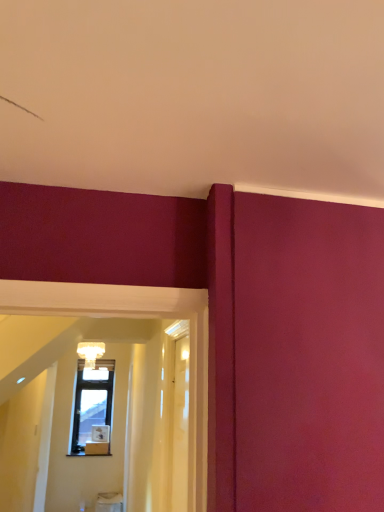
The image size is (384, 512). Find the location of `transparent wood door at center, acting as the first glass door starting from the left`. transparent wood door at center, acting as the first glass door starting from the left is located at coordinates pyautogui.click(x=180, y=426).

This screenshot has height=512, width=384. What do you see at coordinates (180, 426) in the screenshot?
I see `transparent wood door at center, acting as the first glass door starting from the left` at bounding box center [180, 426].

Find the location of a particular element. The image size is (384, 512). transparent wood door at center, marked as the second glass door in a right-to-left arrangement is located at coordinates [180, 426].

Considering the positions of objects transparent wood door at center, acting as the first glass door starting from the left, and matte glass chandelier at upper center in the image provided, who is in front, transparent wood door at center, acting as the first glass door starting from the left, or matte glass chandelier at upper center?

transparent wood door at center, acting as the first glass door starting from the left.

Is transparent wood door at center, marked as the second glass door in a right-to-left arrangement, looking in the opposite direction of matte glass chandelier at upper center?

transparent wood door at center, marked as the second glass door in a right-to-left arrangement, does not have its back to matte glass chandelier at upper center.

Consider the image. Between transparent wood door at center, acting as the first glass door starting from the left, and matte glass chandelier at upper center, which one has smaller width?

With smaller width is transparent wood door at center, acting as the first glass door starting from the left.

Looking at the image, does matte glass chandelier at upper center seem bigger or smaller compared to transparent wood door at center, marked as the second glass door in a right-to-left arrangement?

matte glass chandelier at upper center is bigger than transparent wood door at center, marked as the second glass door in a right-to-left arrangement.

Is matte glass chandelier at upper center behind transparent wood door at center, marked as the second glass door in a right-to-left arrangement?

Yes, the depth of matte glass chandelier at upper center is greater than that of transparent wood door at center, marked as the second glass door in a right-to-left arrangement.

Is matte glass chandelier at upper center oriented towards transparent wood door at center, marked as the second glass door in a right-to-left arrangement?

Yes, matte glass chandelier at upper center faces towards transparent wood door at center, marked as the second glass door in a right-to-left arrangement.

Based on the photo, from the image's perspective, which is above, matte glass chandelier at upper center or transparent wood door at center, marked as the second glass door in a right-to-left arrangement?

From the image's view, transparent wood door at center, marked as the second glass door in a right-to-left arrangement, is above.

Locate an element on the screen. Image resolution: width=384 pixels, height=512 pixels. glass door above the transparent wood door at center, acting as the first glass door starting from the left (from the image's perspective) is located at coordinates (176, 425).

Considering the relative positions of transparent wood door at center, marked as the second glass door in a right-to-left arrangement, and transparent glass door at center, marked as the 1th glass door in a right-to-left arrangement, in the image provided, is transparent wood door at center, marked as the second glass door in a right-to-left arrangement, in front of transparent glass door at center, marked as the 1th glass door in a right-to-left arrangement,?

No, the depth of transparent wood door at center, marked as the second glass door in a right-to-left arrangement, is greater than that of transparent glass door at center, marked as the 1th glass door in a right-to-left arrangement.

From a real-world perspective, which object stands above the other?

In real-world perspective, transparent glass door at center, marked as the second glass door in a left-to-right arrangement, is above.

From the image's perspective, is transparent wood door at center, acting as the first glass door starting from the left, on top of transparent glass door at center, marked as the 1th glass door in a right-to-left arrangement?

Actually, transparent wood door at center, acting as the first glass door starting from the left, appears below transparent glass door at center, marked as the 1th glass door in a right-to-left arrangement, in the image.

Is transparent glass door at center, marked as the 1th glass door in a right-to-left arrangement, wider than matte glass chandelier at upper center?

In fact, transparent glass door at center, marked as the 1th glass door in a right-to-left arrangement, might be narrower than matte glass chandelier at upper center.

Can you confirm if transparent glass door at center, marked as the 1th glass door in a right-to-left arrangement, is positioned to the right of matte glass chandelier at upper center?

Yes, transparent glass door at center, marked as the 1th glass door in a right-to-left arrangement, is to the right of matte glass chandelier at upper center.

Does transparent glass door at center, marked as the 1th glass door in a right-to-left arrangement, touch matte glass chandelier at upper center?

No.

Can you confirm if transparent glass door at center, marked as the second glass door in a left-to-right arrangement, is taller than matte glass chandelier at upper center?

Yes, transparent glass door at center, marked as the second glass door in a left-to-right arrangement, is taller than matte glass chandelier at upper center.

Consider the image. Considering the sizes of objects transparent glass door at center, marked as the 1th glass door in a right-to-left arrangement, and transparent wood door at center, acting as the first glass door starting from the left, in the image provided, who is wider, transparent glass door at center, marked as the 1th glass door in a right-to-left arrangement, or transparent wood door at center, acting as the first glass door starting from the left,?

transparent glass door at center, marked as the 1th glass door in a right-to-left arrangement, is wider.

Identify the location of glass door that is above the transparent wood door at center, acting as the first glass door starting from the left (from a real-world perspective). (176, 425).

Considering the relative positions of transparent glass door at center, marked as the second glass door in a left-to-right arrangement, and transparent wood door at center, acting as the first glass door starting from the left, in the image provided, is transparent glass door at center, marked as the second glass door in a left-to-right arrangement, in front of transparent wood door at center, acting as the first glass door starting from the left,?

Yes, transparent glass door at center, marked as the second glass door in a left-to-right arrangement, is closer to the camera.

Who is shorter, transparent glass door at center, marked as the 1th glass door in a right-to-left arrangement, or transparent wood door at center, marked as the second glass door in a right-to-left arrangement?

With less height is transparent wood door at center, marked as the second glass door in a right-to-left arrangement.

Based on the photo, is matte glass chandelier at upper center beside transparent glass door at center, marked as the 1th glass door in a right-to-left arrangement?

No, matte glass chandelier at upper center is not next to transparent glass door at center, marked as the 1th glass door in a right-to-left arrangement.

Considering the sizes of objects matte glass chandelier at upper center and transparent glass door at center, marked as the 1th glass door in a right-to-left arrangement, in the image provided, who is wider, matte glass chandelier at upper center or transparent glass door at center, marked as the 1th glass door in a right-to-left arrangement,?

Wider between the two is matte glass chandelier at upper center.

From a real-world perspective, is matte glass chandelier at upper center positioned above or below transparent glass door at center, marked as the 1th glass door in a right-to-left arrangement?

matte glass chandelier at upper center is above transparent glass door at center, marked as the 1th glass door in a right-to-left arrangement.

Identify the location of the 1st glass door in front of the matte glass chandelier at upper center, starting your count from the anchor. [x=180, y=426].

From the matte glass chandelier at upper center, count 1st glass door to the right and point to it. Please provide its 2D coordinates.

[(180, 426)]

Which object lies nearer to the anchor point transparent glass door at center, marked as the second glass door in a left-to-right arrangement, matte glass chandelier at upper center or transparent wood door at center, acting as the first glass door starting from the left?

Based on the image, transparent wood door at center, acting as the first glass door starting from the left, appears to be nearer to transparent glass door at center, marked as the second glass door in a left-to-right arrangement.

Which object lies nearer to the anchor point matte glass chandelier at upper center, transparent wood door at center, acting as the first glass door starting from the left, or transparent glass door at center, marked as the second glass door in a left-to-right arrangement?

transparent glass door at center, marked as the second glass door in a left-to-right arrangement, is closer to matte glass chandelier at upper center.

Based on their spatial positions, is matte glass chandelier at upper center or transparent glass door at center, marked as the 1th glass door in a right-to-left arrangement, closer to transparent wood door at center, acting as the first glass door starting from the left?

Among the two, transparent glass door at center, marked as the 1th glass door in a right-to-left arrangement, is located nearer to transparent wood door at center, acting as the first glass door starting from the left.

Looking at the image, which one is located closer to matte glass chandelier at upper center, transparent glass door at center, marked as the second glass door in a left-to-right arrangement, or transparent wood door at center, acting as the first glass door starting from the left?

The object closer to matte glass chandelier at upper center is transparent glass door at center, marked as the second glass door in a left-to-right arrangement.

Based on their spatial positions, is transparent wood door at center, marked as the second glass door in a right-to-left arrangement, or matte glass chandelier at upper center further from transparent glass door at center, marked as the second glass door in a left-to-right arrangement?

matte glass chandelier at upper center is positioned further to the anchor transparent glass door at center, marked as the second glass door in a left-to-right arrangement.

Consider the image. Considering their positions, is transparent glass door at center, marked as the 1th glass door in a right-to-left arrangement, positioned closer to transparent wood door at center, marked as the second glass door in a right-to-left arrangement, than matte glass chandelier at upper center?

transparent glass door at center, marked as the 1th glass door in a right-to-left arrangement, lies closer to transparent wood door at center, marked as the second glass door in a right-to-left arrangement, than the other object.

Locate an element on the screen. The width and height of the screenshot is (384, 512). glass door between transparent glass door at center, marked as the 1th glass door in a right-to-left arrangement, and matte glass chandelier at upper center, along the z-axis is located at coordinates tap(180, 426).